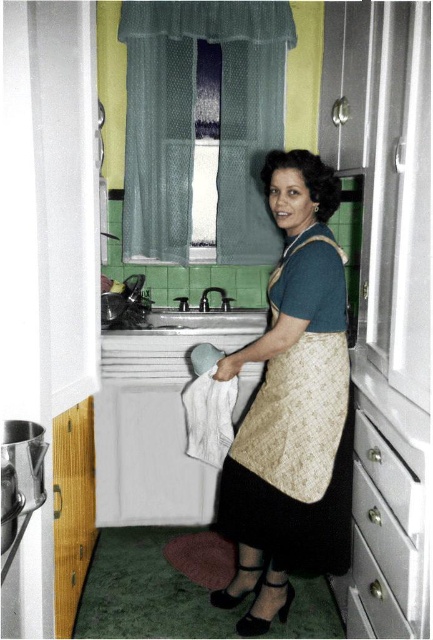
You are organizing the kitchen and need to place a new decorative item between the matte gold apron at center and the metallic silver drawer at lower right. Based on their positions, which side of the drawer should you place it on?

The matte gold apron at center is to the left of the metallic silver drawer at lower right, so you should place the decorative item to the right side of the drawer to maintain the left to right order.

You are standing in the vintage kitchen scene. You need to locate the matte gold apron at center. Where is it positioned in terms of coordinates?

The matte gold apron at center is located at coordinates approximately 0.637 on the x axis and 0.674 on the y axis.

You are standing in the vintage kitchen and want to place a small plant between the two points marked as point (339, 182) and point (364, 602). Since the plant needs to be placed closer to you, which point should you choose?

You should choose point (339, 182) because it is closer to you than point (364, 602).